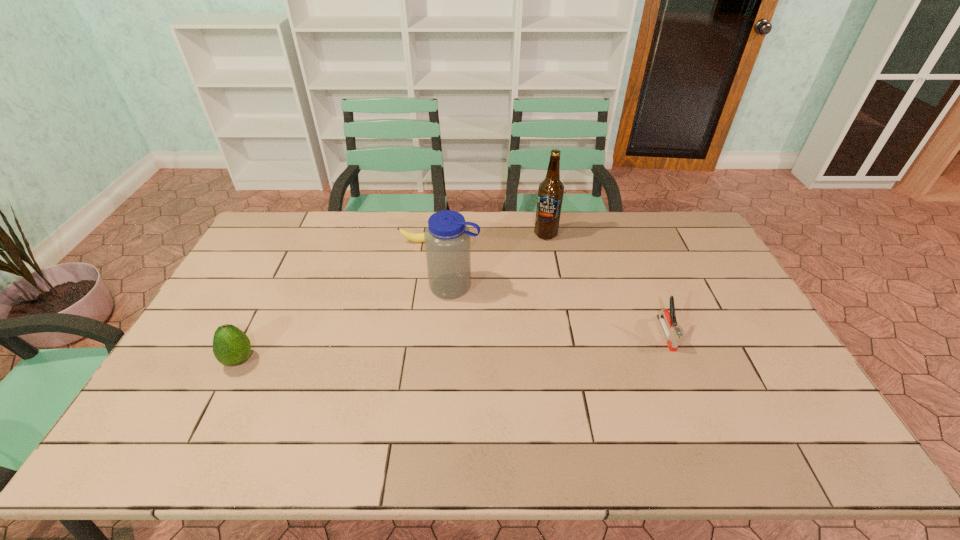
Identify the location of avocado. The image size is (960, 540). 231,346.

Where is `the leftmost object`? The height and width of the screenshot is (540, 960). the leftmost object is located at coordinates (231, 346).

Image resolution: width=960 pixels, height=540 pixels. Identify the location of the rightmost object. (673, 334).

The height and width of the screenshot is (540, 960). I want to click on stapler, so click(x=673, y=334).

Locate an element on the screen. The width and height of the screenshot is (960, 540). banana is located at coordinates 416,237.

This screenshot has width=960, height=540. I want to click on water bottle, so click(447, 237).

Identify the location of the third nearest object. Image resolution: width=960 pixels, height=540 pixels. (447, 237).

I want to click on the second object from right to left, so click(550, 192).

The width and height of the screenshot is (960, 540). I want to click on the tallest object, so click(x=550, y=192).

Find the location of a particular element. This screenshot has width=960, height=540. free location located 0.050m on the back of the avocado is located at coordinates (252, 334).